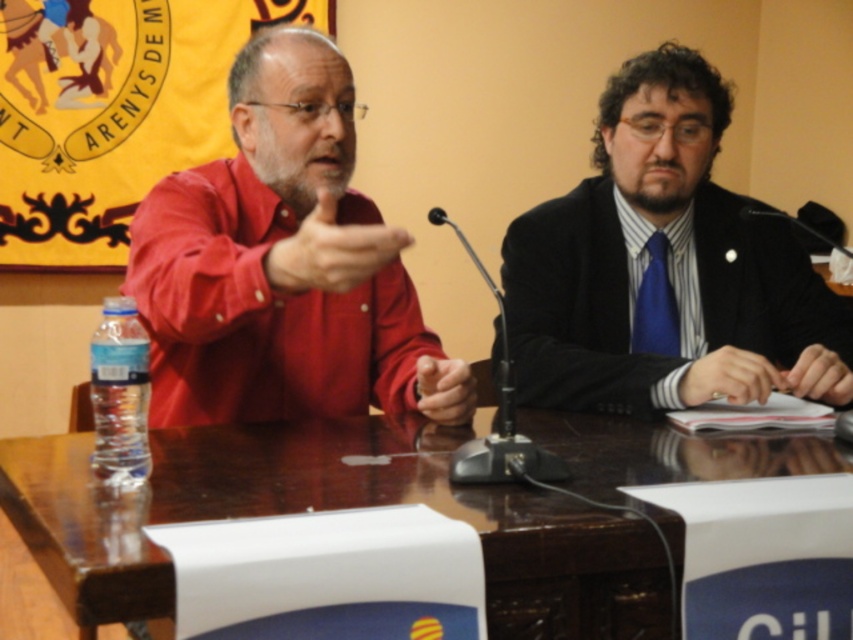
Question: Can you confirm if brown wooden table at center is smaller than blue silk hand at center?

Choices:
 (A) yes
 (B) no

Answer: (B)

Question: Which object is positioned farthest from the blue silk tie at right?

Choices:
 (A) black matte paper at center
 (B) blue silk tie at center
 (C) black plastic microphone at center
 (D) blue silk hand at center

Answer: (C)

Question: Can you confirm if matte red shirt at center is positioned above black plastic microphone at center?

Choices:
 (A) yes
 (B) no

Answer: (A)

Question: Which of the following is the closest to the observer?

Choices:
 (A) (527, 456)
 (B) (299, 273)
 (C) (451, 394)
 (D) (225, 326)

Answer: (A)

Question: Which object appears farthest from the camera in this image?

Choices:
 (A) black matte paper at center
 (B) matte red shirt at center
 (C) blue silk tie at right

Answer: (A)

Question: Is brown wooden table at center wider than matte red shirt at left?

Choices:
 (A) no
 (B) yes

Answer: (B)